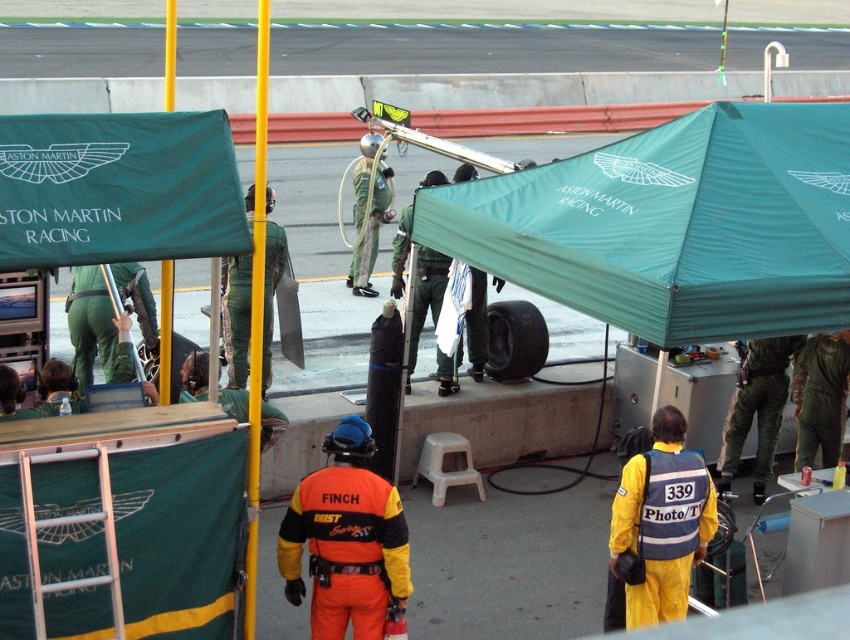
Question: Can you confirm if green fabric canopy at upper center is positioned below yellow reflective vest at center?

Choices:
 (A) no
 (B) yes

Answer: (A)

Question: Which point is farther from the camera taking this photo?

Choices:
 (A) (9, 196)
 (B) (748, 328)

Answer: (B)

Question: Which point is farther from the camera taking this photo?

Choices:
 (A) (374, 204)
 (B) (337, 534)

Answer: (A)

Question: Is green fabric canopy at upper left thinner than orange fabric safety vest at center?

Choices:
 (A) no
 (B) yes

Answer: (A)

Question: Does green fabric canopy at upper center lie behind orange fabric safety vest at center?

Choices:
 (A) no
 (B) yes

Answer: (A)

Question: Estimate the real-world distances between objects in this image. Which object is closer to the green fabric canopy at upper left?

Choices:
 (A) green fabric canopy at upper center
 (B) orange fabric safety vest at center
 (C) camouflage fabric jumpsuit at center

Answer: (B)